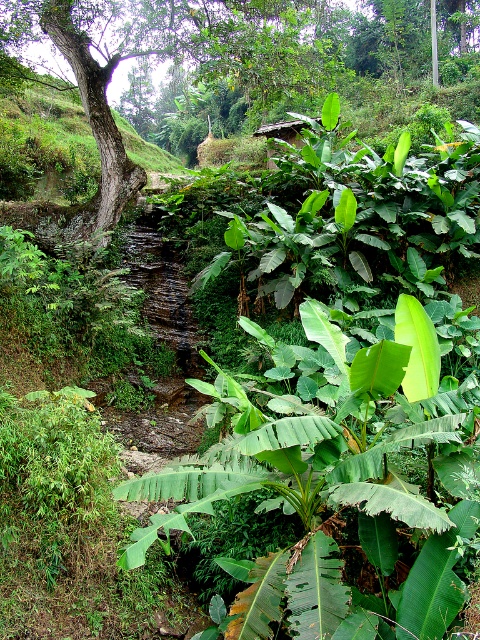
Question: Does green leafy banana tree at center have a larger size compared to green leafy tree at center?

Choices:
 (A) no
 (B) yes

Answer: (A)

Question: Which point is farther to the camera?

Choices:
 (A) green leafy tree at center
 (B) green leafy banana tree at center

Answer: (A)

Question: Can you confirm if green leafy banana tree at center is thinner than green leafy tree at center?

Choices:
 (A) no
 (B) yes

Answer: (B)

Question: Which object appears closest to the camera in this image?

Choices:
 (A) green leafy banana tree at center
 (B) green leafy tree at center

Answer: (A)

Question: Which of the following is the closest to the observer?

Choices:
 (A) (191, 44)
 (B) (192, 502)

Answer: (B)

Question: Where is green leafy banana tree at center located in relation to green leafy tree at center in the image?

Choices:
 (A) right
 (B) left

Answer: (A)